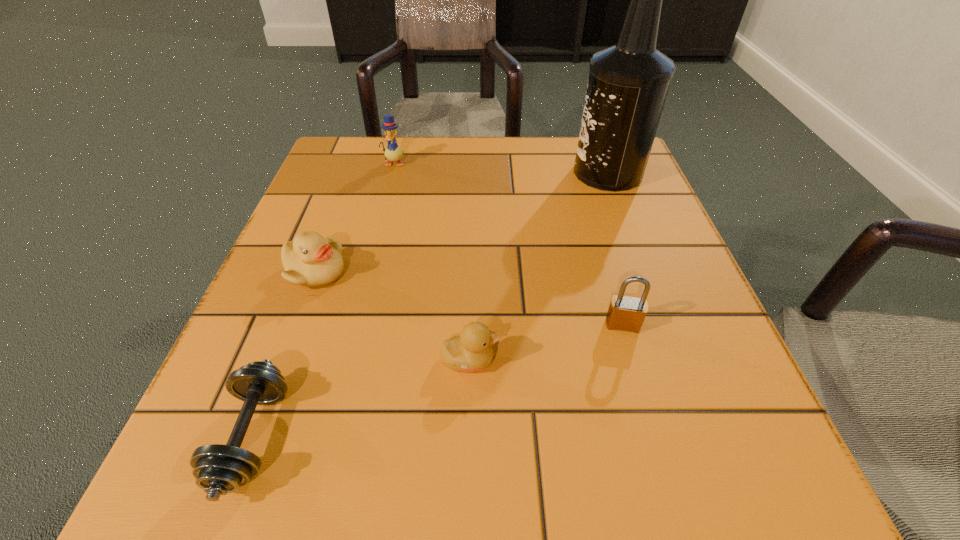
Image resolution: width=960 pixels, height=540 pixels. I want to click on vacant space that satisfies the following two spatial constraints: 1. on the beak of the third farthest object; 2. on the left side of the dumbbell, so click(253, 437).

Locate an element on the screen. vacant area in the image that satisfies the following two spatial constraints: 1. on the beak of the dumbbell; 2. on the left side of the second nearest duckling is located at coordinates (253, 437).

Image resolution: width=960 pixels, height=540 pixels. Find the location of `vacant position in the image that satisfies the following two spatial constraints: 1. on the face of the tallest duckling, where the monocle is placed; 2. on the beak of the second farthest duckling`. vacant position in the image that satisfies the following two spatial constraints: 1. on the face of the tallest duckling, where the monocle is placed; 2. on the beak of the second farthest duckling is located at coordinates (366, 272).